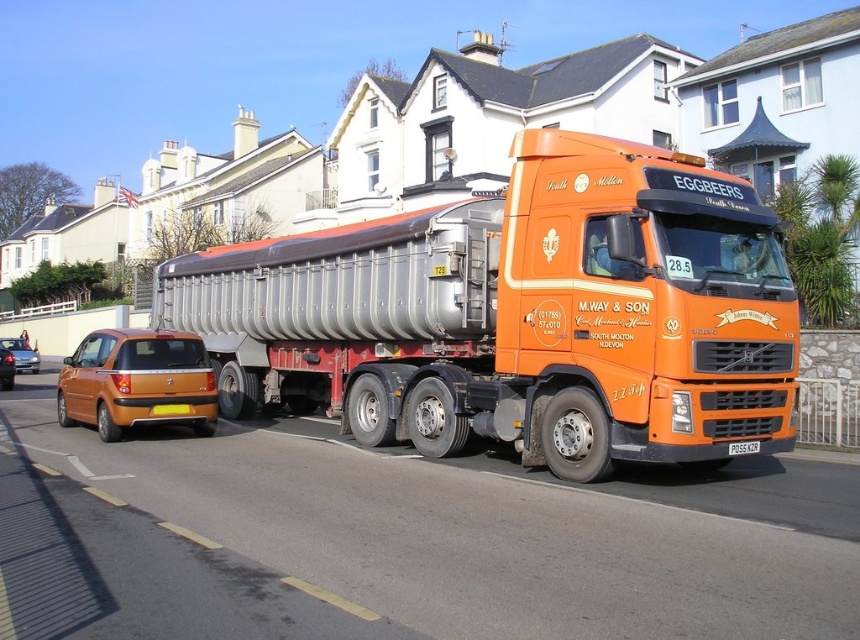
Does orange matte hatchback at left appear on the right side of whitemetalliclicense plate at right?

In fact, orange matte hatchback at left is to the left of whitemetalliclicense plate at right.

Which is in front, point (28, 364) or point (746, 445)?

Point (746, 445)

At what (x,y) coordinates should I click in order to perform the action: click on orange matte hatchback at left. Please return your answer as a coordinate pair (x, y). Looking at the image, I should click on (22, 355).

Consider the image. Is metallic orange hatchback at left to the right of orange matte hatchback at left from the viewer's perspective?

Yes, metallic orange hatchback at left is to the right of orange matte hatchback at left.

Locate an element on the screen. metallic orange hatchback at left is located at coordinates (137, 381).

Between point (269, 356) and point (11, 360), which one is positioned behind?

Positioned behind is point (11, 360).

Does point (705, 369) lie in front of point (2, 356)?

Yes, it is.

Between point (611, 291) and point (1, 348), which one is positioned in front?

Positioned in front is point (611, 291).

The height and width of the screenshot is (640, 860). I want to click on orange matte truck at center, so click(x=520, y=314).